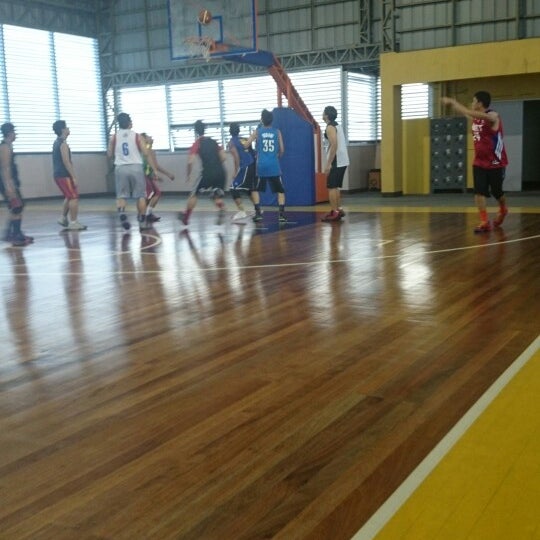
The height and width of the screenshot is (540, 540). I want to click on floor, so click(x=281, y=319).